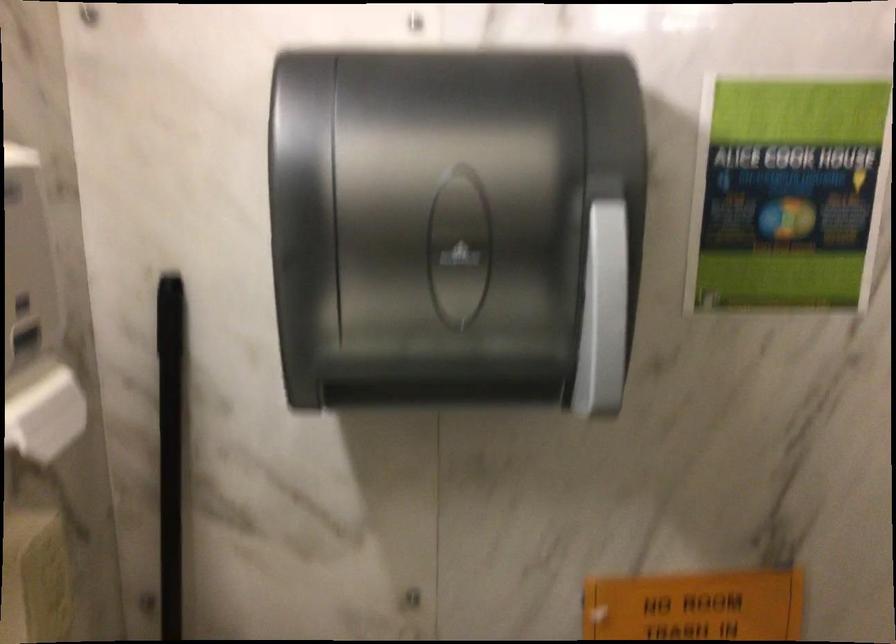
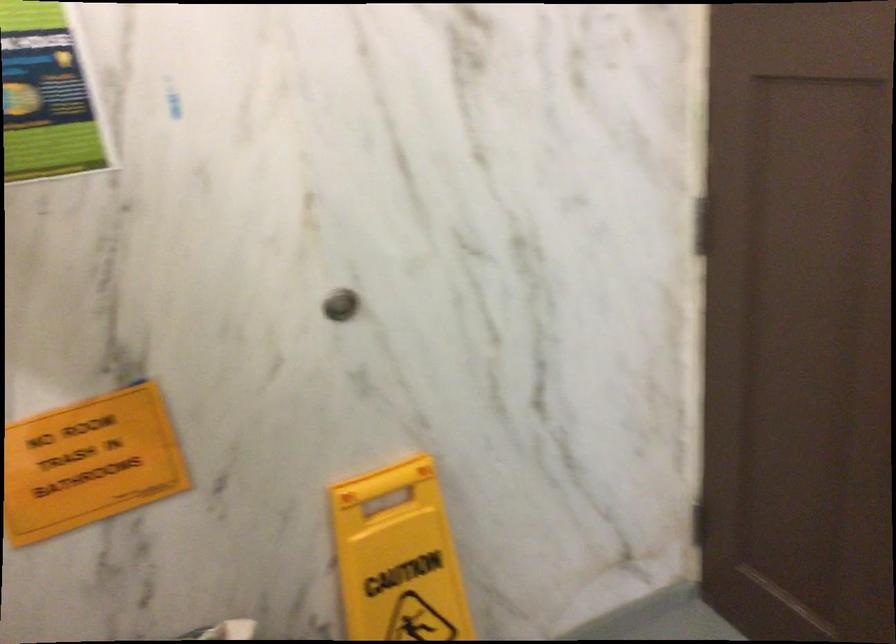
Question: Based on the continuous images, in which direction is the camera rotating? Reply with the corresponding letter.

Choices:
 (A) Left
 (B) Right
 (C) Up
 (D) Down

Answer: (B)